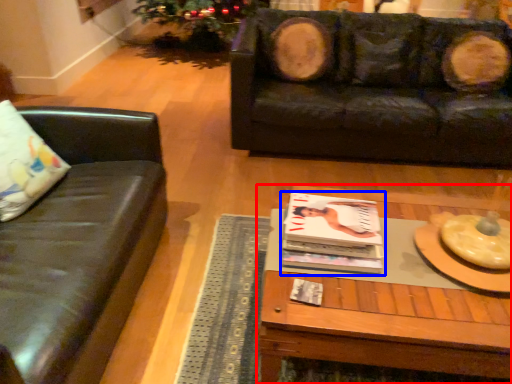
Question: Among these objects, which one is farthest to the camera, coffee table (highlighted by a red box) or magazine (highlighted by a blue box)?

Choices:
 (A) coffee table
 (B) magazine

Answer: (B)